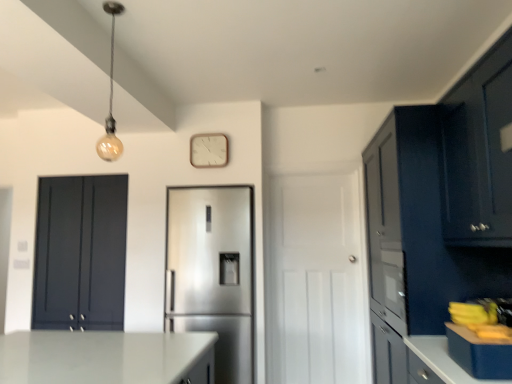
At what (x,y) coordinates should I click in order to perform the action: click on vacant area on top of blue matte countertop at right (from a real-world perspective). Please return your answer as a coordinate pair (x, y). Looking at the image, I should click on point(481,321).